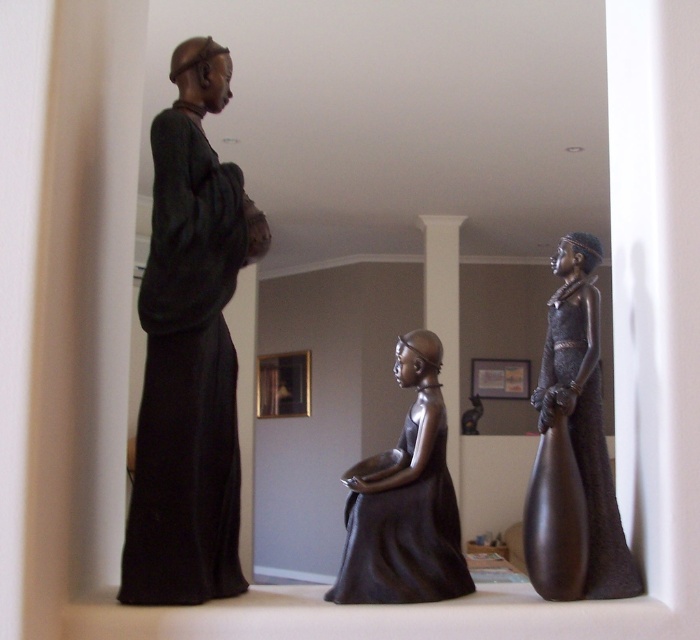
You are standing in front of the three bronze figurines on the shelf. You want to place a small vase between the matte black robe at left and the shiny dark brown dress at right. Can you fit it there?

The matte black robe at left is in front of the shiny dark brown dress at right, so there is space between them to place the vase.

You are arranging a display of artifacts in a museum. You have two items to place on a shelf next to each other. The items are the matte black statue at center and the shiny dark brown dress at right. Based on the image, which item should be placed on the left side of the shelf to match the original arrangement?

The matte black statue at center should be placed on the left side of the shelf because, according to the description, it is to the left of the shiny dark brown dress at right.